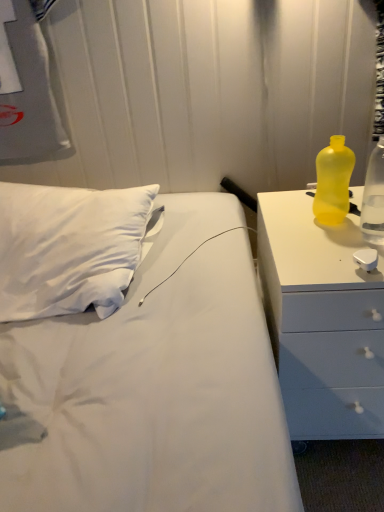
At what (x,y) coordinates should I click in order to perform the action: click on free area behind yellow translucent bottle at right, the first bottle positioned from the right. Please return your answer as a coordinate pair (x, y). This screenshot has height=512, width=384. Looking at the image, I should click on (349, 199).